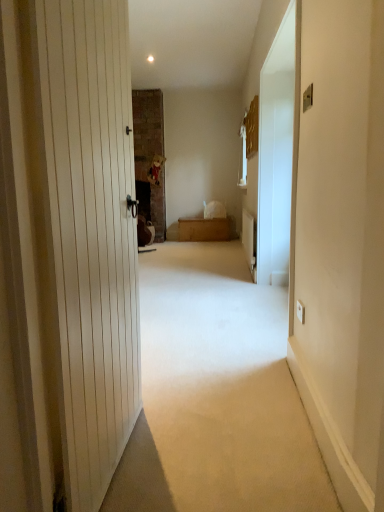
Where is `free space in front of white glossy screen door at right`? This screenshot has width=384, height=512. free space in front of white glossy screen door at right is located at coordinates (241, 351).